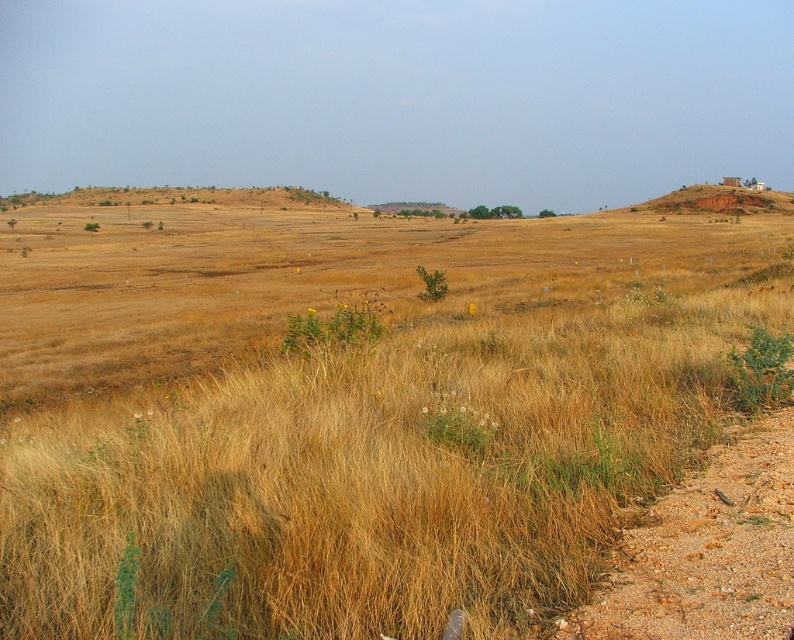
Question: From the image, what is the correct spatial relationship of brown grassy field at center in relation to dirt/gravel path at lower right?

Choices:
 (A) below
 (B) above

Answer: (B)

Question: Can you confirm if brown grassy field at center is positioned below dirt/gravel path at lower right?

Choices:
 (A) yes
 (B) no

Answer: (B)

Question: Among these points, which one is farthest from the camera?

Choices:
 (A) (742, 429)
 (B) (75, 394)

Answer: (B)

Question: In this image, where is brown grassy field at center located relative to dirt/gravel path at lower right?

Choices:
 (A) above
 (B) below

Answer: (A)